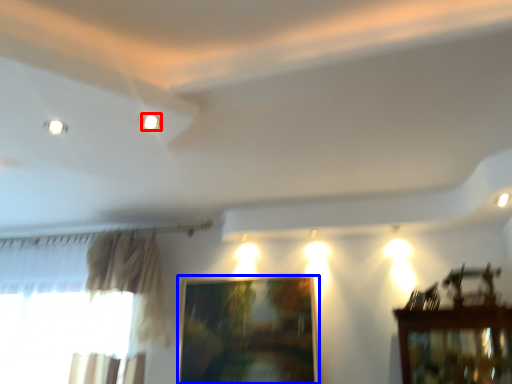
Question: Which object appears closest to the camera in this image, lighting (highlighted by a red box) or picture frame (highlighted by a blue box)?

Choices:
 (A) lighting
 (B) picture frame

Answer: (A)